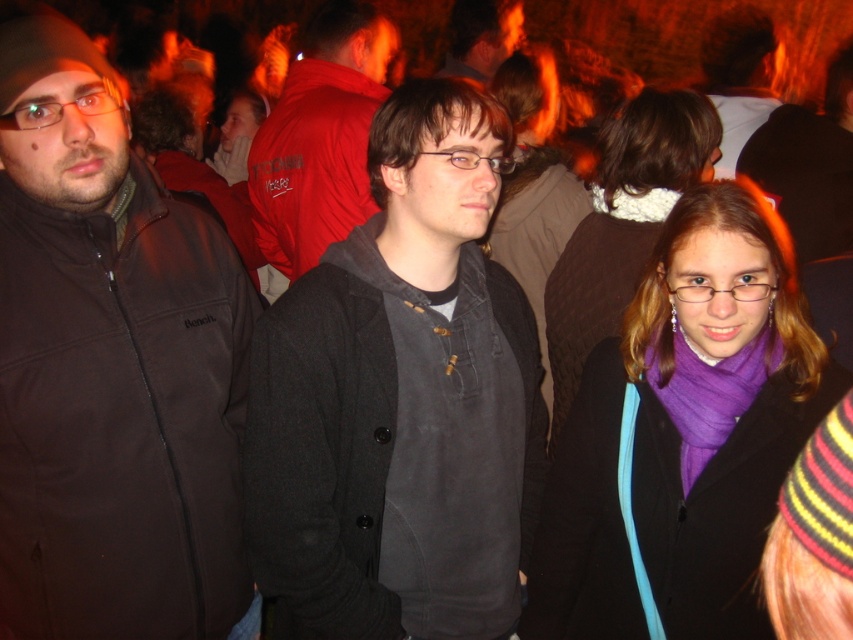
Does point (415, 172) come behind point (509, 24)?

No, (415, 172) is in front of (509, 24).

Between point (514, 547) and point (492, 12), which one is positioned behind?

Point (492, 12)

Find the location of `dark gray hoodie at center`. dark gray hoodie at center is located at coordinates (399, 400).

Does brown fleece jacket at left have a larger size compared to matte black jacket at center?

Actually, brown fleece jacket at left might be smaller than matte black jacket at center.

Consider the image. Who is lower down, brown fleece jacket at left or matte black jacket at center?

brown fleece jacket at left

Is point (38, 45) positioned behind point (463, 44)?

No, it is in front of (463, 44).

You are a GUI agent. You are given a task and a screenshot of the screen. Output one action in this format:
    pyautogui.click(x=<x>, y=<y>)
    Task: Click on the brown fleece jacket at left
    The height and width of the screenshot is (640, 853).
    Given the screenshot: What is the action you would take?
    pyautogui.click(x=109, y=365)

Who is more forward, (x=618, y=173) or (x=469, y=26)?

Point (x=618, y=173) is in front.

Does purple knitted scarf at center appear on the left side of matte black jacket at center?

In fact, purple knitted scarf at center is to the right of matte black jacket at center.

Find the location of a particular element. This screenshot has width=853, height=640. purple knitted scarf at center is located at coordinates (624, 225).

This screenshot has height=640, width=853. What are the coordinates of `purple knitted scarf at center` in the screenshot? It's located at (624, 225).